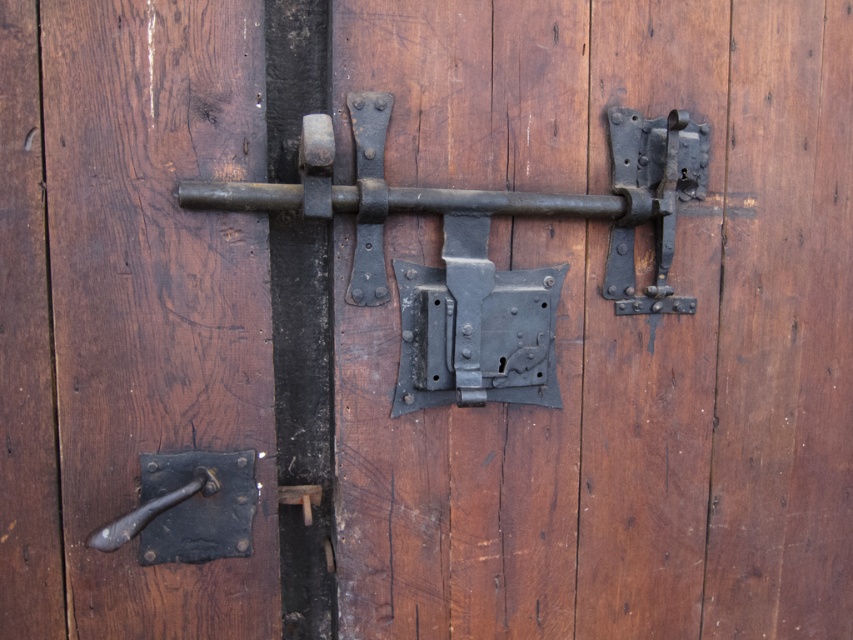
Question: Which point appears closest to the camera in this image?

Choices:
 (A) (381, 204)
 (B) (209, 509)
 (C) (126, 352)

Answer: (C)

Question: Is black matte metal bar at center below dark brown metal handle at lower left?

Choices:
 (A) yes
 (B) no

Answer: (B)

Question: Which point is farther from the camera taking this photo?

Choices:
 (A) (78, 620)
 (B) (631, 284)
 (C) (160, 460)

Answer: (B)

Question: Among these objects, which one is farthest from the camera?

Choices:
 (A) matte black handle at left
 (B) black matte metal bar at center
 (C) dark brown metal handle at lower left

Answer: (A)

Question: Considering the relative positions of matte black handle at left and dark brown metal handle at lower left in the image provided, where is matte black handle at left located with respect to dark brown metal handle at lower left?

Choices:
 (A) above
 (B) below

Answer: (A)

Question: Does black matte metal bar at center have a smaller size compared to dark brown metal handle at lower left?

Choices:
 (A) no
 (B) yes

Answer: (A)